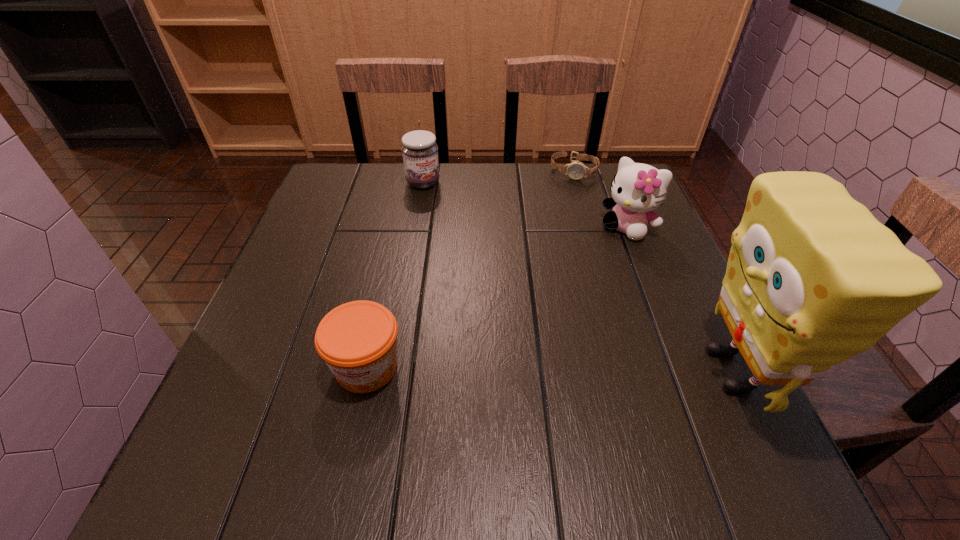
Where is `vacant space at the far edge of the desktop`? Image resolution: width=960 pixels, height=540 pixels. vacant space at the far edge of the desktop is located at coordinates (518, 188).

The image size is (960, 540). In the image, there is a desktop. In order to click on free space at the near edge in this screenshot , I will do `click(425, 396)`.

Identify the location of vacant space at the left edge of the desktop. (260, 348).

This screenshot has width=960, height=540. In order to click on vacant space at the right edge in this screenshot , I will do `click(686, 309)`.

This screenshot has height=540, width=960. In the image, there is a desktop. Find the location of `vacant space at the far left corner`. vacant space at the far left corner is located at coordinates (334, 184).

This screenshot has width=960, height=540. I want to click on vacant space at the near left corner, so click(x=234, y=402).

I want to click on free spot between the taller jam and the tallest object, so click(577, 276).

The image size is (960, 540). Find the location of `free space between the sponge and the third farthest object`. free space between the sponge and the third farthest object is located at coordinates (680, 299).

Find the location of a particular element. empty location between the taller jam and the second tallest object is located at coordinates [525, 205].

Find the location of a particular element. vacant region between the sponge and the second shortest object is located at coordinates (549, 369).